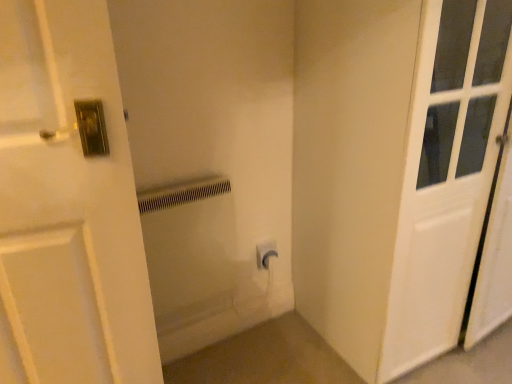
Question: Is white plastic electric outlet at center looking in the opposite direction of white matte door at right?

Choices:
 (A) yes
 (B) no

Answer: (B)

Question: Considering the relative positions of white plastic electric outlet at center and white matte door at right in the image provided, is white plastic electric outlet at center in front of white matte door at right?

Choices:
 (A) yes
 (B) no

Answer: (B)

Question: Is white plastic electric outlet at center touching white matte door at right?

Choices:
 (A) yes
 (B) no

Answer: (B)

Question: Is white plastic electric outlet at center positioned behind white matte door at right?

Choices:
 (A) yes
 (B) no

Answer: (A)

Question: Is white matte door at right located within white plastic electric outlet at center?

Choices:
 (A) yes
 (B) no

Answer: (B)

Question: Is white plastic electric outlet at center far away from white matte door at right?

Choices:
 (A) no
 (B) yes

Answer: (A)

Question: Considering the relative positions of white plastic radiator at center and white matte door at right in the image provided, is white plastic radiator at center to the left of white matte door at right from the viewer's perspective?

Choices:
 (A) no
 (B) yes

Answer: (B)

Question: Is white plastic radiator at center at the right side of white matte door at right?

Choices:
 (A) yes
 (B) no

Answer: (B)

Question: Is white plastic radiator at center thinner than white matte door at right?

Choices:
 (A) yes
 (B) no

Answer: (A)

Question: Is white plastic radiator at center bigger than white matte door at right?

Choices:
 (A) yes
 (B) no

Answer: (B)

Question: Does white plastic radiator at center come behind white matte door at right?

Choices:
 (A) yes
 (B) no

Answer: (A)

Question: Does white plastic radiator at center contain white matte door at right?

Choices:
 (A) yes
 (B) no

Answer: (B)

Question: Is white plastic radiator at center facing away from white plastic electric outlet at center?

Choices:
 (A) no
 (B) yes

Answer: (B)